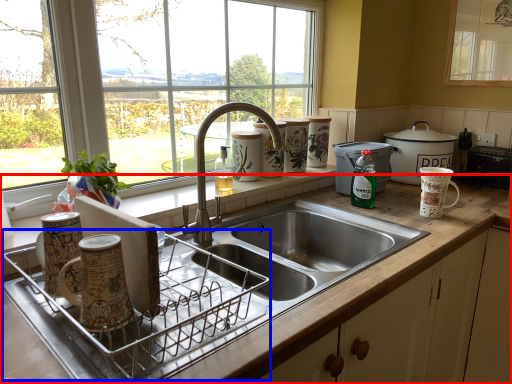
Question: Among these objects, which one is nearest to the camera, countertop (highlighted by a red box) or appliance (highlighted by a blue box)?

Choices:
 (A) countertop
 (B) appliance

Answer: (A)